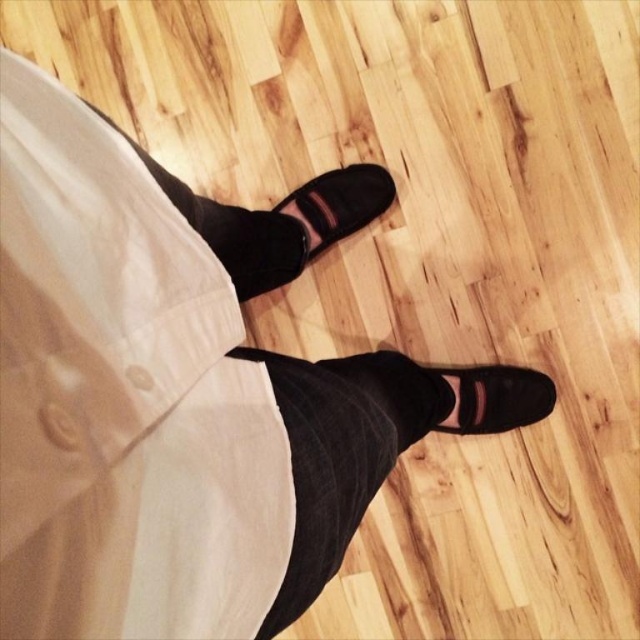
Is black suede pants at center smaller than suede/black shoe at center?

Actually, black suede pants at center might be larger than suede/black shoe at center.

Identify the location of black suede pants at center. [340, 452].

Does black suede pants at center appear on the right side of suede/black shoe at lower right?

No, black suede pants at center is not to the right of suede/black shoe at lower right.

Based on the photo, can you confirm if black suede pants at center is positioned below suede/black shoe at lower right?

No, black suede pants at center is not below suede/black shoe at lower right.

Find the location of a particular element. Image resolution: width=640 pixels, height=640 pixels. black suede pants at center is located at coordinates (x=340, y=452).

This screenshot has height=640, width=640. I want to click on black suede pants at center, so click(x=340, y=452).

Between suede/black shoe at center and suede/black shoe at lower right, which one is positioned lower?

suede/black shoe at lower right is lower down.

Based on the photo, does suede/black shoe at center appear under suede/black shoe at lower right?

Incorrect, suede/black shoe at center is not positioned below suede/black shoe at lower right.

Between point (340, 234) and point (460, 432), which one is positioned in front?

Point (460, 432) is in front.

Where is `suede/black shoe at center`? suede/black shoe at center is located at coordinates (339, 204).